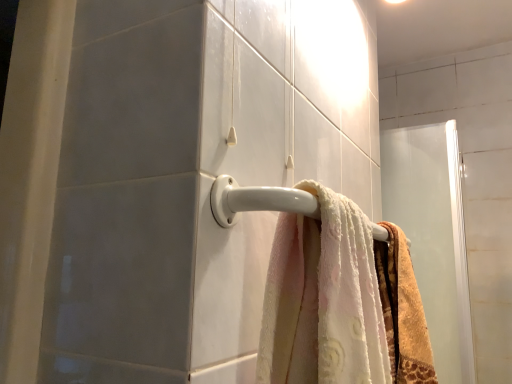
Describe the element at coordinates (403, 310) in the screenshot. I see `beige textured towel at center` at that location.

I want to click on beige textured towel at center, so click(x=403, y=310).

Where is `beige textured towel at center`? This screenshot has width=512, height=384. beige textured towel at center is located at coordinates (403, 310).